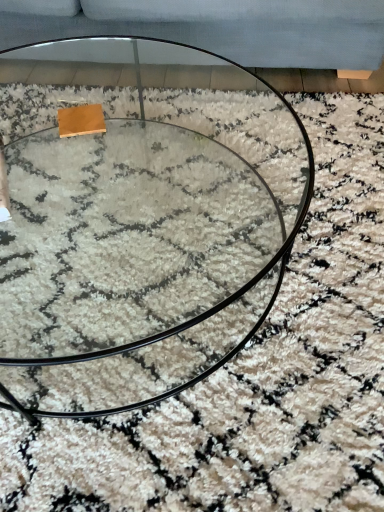
I want to click on free space above clear glass coffee table at center (from a real-world perspective), so click(118, 167).